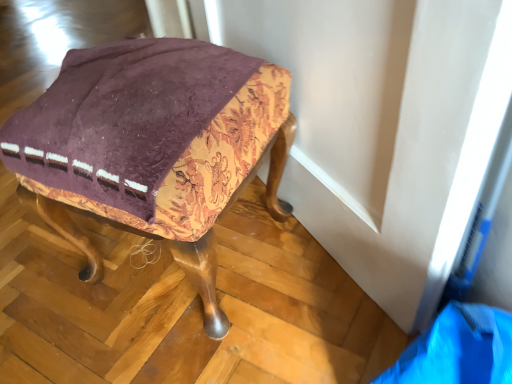
The image size is (512, 384). In order to click on velvet purple ottoman at center in this screenshot , I will do `click(154, 146)`.

Measure the distance between point (234, 111) and camera.

Point (234, 111) and camera are 65.00 centimeters apart.

Describe the element at coordinates (154, 146) in the screenshot. I see `velvet purple ottoman at center` at that location.

This screenshot has width=512, height=384. Find the location of `velvet purple ottoman at center`. velvet purple ottoman at center is located at coordinates (154, 146).